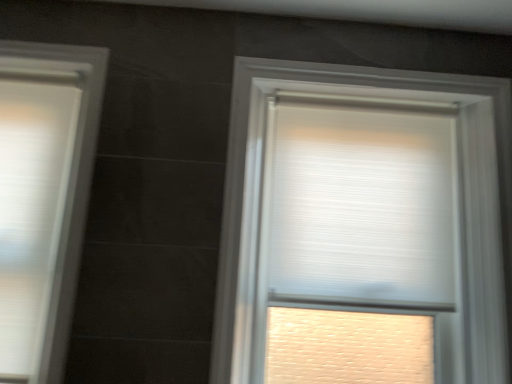
What is the approximate width of white pleated blind at upper center?

The width of white pleated blind at upper center is 6.50 inches.

The height and width of the screenshot is (384, 512). I want to click on white textured roller blind at center, which is the second window from left to right, so click(456, 207).

Could you measure the distance between white textured roller blind at center, arranged as the first window when viewed from the right, and white pleated blind at upper center?

white textured roller blind at center, arranged as the first window when viewed from the right, and white pleated blind at upper center are 13.52 centimeters apart from each other.

Considering the relative positions of white textured roller blind at center, which is the second window from left to right, and white pleated blind at upper center in the image provided, is white textured roller blind at center, which is the second window from left to right, to the right of white pleated blind at upper center from the viewer's perspective?

→ No.

Is point (505, 260) closer to viewer compared to point (438, 205)?

Yes, it is in front of point (438, 205).

In the image, is white textured roller blind at center, which is the second window from left to right, positioned in front of or behind white pleated blind at upper center?

white textured roller blind at center, which is the second window from left to right, is in front of white pleated blind at upper center.

Which of these two, white matte window at left, which is the second window in right-to-left order, or white pleated blind at upper center, is wider?

With larger width is white pleated blind at upper center.

From the image's perspective, which one is positioned lower, white matte window at left, acting as the first window starting from the left, or white pleated blind at upper center?

white matte window at left, acting as the first window starting from the left.

Who is bigger, white matte window at left, acting as the first window starting from the left, or white pleated blind at upper center?

white pleated blind at upper center.

Which is more to the left, white matte window at left, which is the second window in right-to-left order, or white textured roller blind at center, which is the second window from left to right?

white matte window at left, which is the second window in right-to-left order.

Which of these two, white matte window at left, which is the second window in right-to-left order, or white textured roller blind at center, arranged as the first window when viewed from the right, stands shorter?

Standing shorter between the two is white matte window at left, which is the second window in right-to-left order.

Considering the sizes of objects white matte window at left, acting as the first window starting from the left, and white textured roller blind at center, which is the second window from left to right, in the image provided, who is wider, white matte window at left, acting as the first window starting from the left, or white textured roller blind at center, which is the second window from left to right,?

With larger width is white textured roller blind at center, which is the second window from left to right.

From the image's perspective, between white pleated blind at upper center and white matte window at left, which is the second window in right-to-left order, who is located below?

white matte window at left, which is the second window in right-to-left order, is shown below in the image.

Which point is more distant from viewer, (330, 286) or (35, 132)?

The point (35, 132) is farther from the camera.

In terms of height, does white pleated blind at upper center look taller or shorter compared to white matte window at left, which is the second window in right-to-left order?

white pleated blind at upper center is shorter than white matte window at left, which is the second window in right-to-left order.

From the picture: Can you confirm if white pleated blind at upper center is smaller than white matte window at left, acting as the first window starting from the left?

No, white pleated blind at upper center is not smaller than white matte window at left, acting as the first window starting from the left.

Considering the relative sizes of white pleated blind at upper center and white textured roller blind at center, arranged as the first window when viewed from the right, in the image provided, is white pleated blind at upper center wider than white textured roller blind at center, arranged as the first window when viewed from the right,?

No, white pleated blind at upper center is not wider than white textured roller blind at center, arranged as the first window when viewed from the right.

Is white pleated blind at upper center completely or partially outside of white textured roller blind at center, which is the second window from left to right?

Actually, white pleated blind at upper center is within white textured roller blind at center, which is the second window from left to right.

How much distance is there between white pleated blind at upper center and white textured roller blind at center, arranged as the first window when viewed from the right?

5.32 inches.

Does point (365, 254) come farther from viewer compared to point (303, 70)?

Yes, point (365, 254) is behind point (303, 70).

Which is more to the right, white textured roller blind at center, arranged as the first window when viewed from the right, or white matte window at left, acting as the first window starting from the left?

→ Positioned to the right is white textured roller blind at center, arranged as the first window when viewed from the right.

Locate an element on the screen. The image size is (512, 384). window located on the right of white matte window at left, acting as the first window starting from the left is located at coordinates (456, 207).

From the image's perspective, relative to white matte window at left, which is the second window in right-to-left order, is white textured roller blind at center, which is the second window from left to right, above or below?

From the image's perspective, white textured roller blind at center, which is the second window from left to right, appears below white matte window at left, which is the second window in right-to-left order.

From a real-world perspective, between white textured roller blind at center, which is the second window from left to right, and white matte window at left, which is the second window in right-to-left order, who is vertically lower?

white matte window at left, which is the second window in right-to-left order, is physically lower.

The image size is (512, 384). What are the coordinates of `window blind lying on the right of white textured roller blind at center, which is the second window from left to right` in the screenshot? It's located at (360, 207).

Locate an element on the screen. The width and height of the screenshot is (512, 384). window blind above the white matte window at left, acting as the first window starting from the left (from the image's perspective) is located at coordinates (360, 207).

Estimate the real-world distances between objects in this image. Which object is further from white pleated blind at upper center, white textured roller blind at center, which is the second window from left to right, or white matte window at left, which is the second window in right-to-left order?

white matte window at left, which is the second window in right-to-left order.

Looking at this image, based on their spatial positions, is white textured roller blind at center, arranged as the first window when viewed from the right, or white pleated blind at upper center closer to white matte window at left, which is the second window in right-to-left order?

Among the two, white textured roller blind at center, arranged as the first window when viewed from the right, is located nearer to white matte window at left, which is the second window in right-to-left order.

Based on their spatial positions, is white matte window at left, which is the second window in right-to-left order, or white textured roller blind at center, which is the second window from left to right, closer to white pleated blind at upper center?

white textured roller blind at center, which is the second window from left to right.

When comparing their distances from white textured roller blind at center, arranged as the first window when viewed from the right, does white pleated blind at upper center or white matte window at left, which is the second window in right-to-left order, seem further?

Based on the image, white matte window at left, which is the second window in right-to-left order, appears to be further to white textured roller blind at center, arranged as the first window when viewed from the right.

Looking at the image, which one is located closer to white textured roller blind at center, which is the second window from left to right, white matte window at left, acting as the first window starting from the left, or white pleated blind at upper center?

white pleated blind at upper center is closer to white textured roller blind at center, which is the second window from left to right.

Based on their spatial positions, is white pleated blind at upper center or white textured roller blind at center, which is the second window from left to right, closer to white matte window at left, which is the second window in right-to-left order?

Among the two, white textured roller blind at center, which is the second window from left to right, is located nearer to white matte window at left, which is the second window in right-to-left order.

The image size is (512, 384). Find the location of `window between white matte window at left, which is the second window in right-to-left order, and white pleated blind at upper center, in the horizontal direction`. window between white matte window at left, which is the second window in right-to-left order, and white pleated blind at upper center, in the horizontal direction is located at coordinates (456, 207).